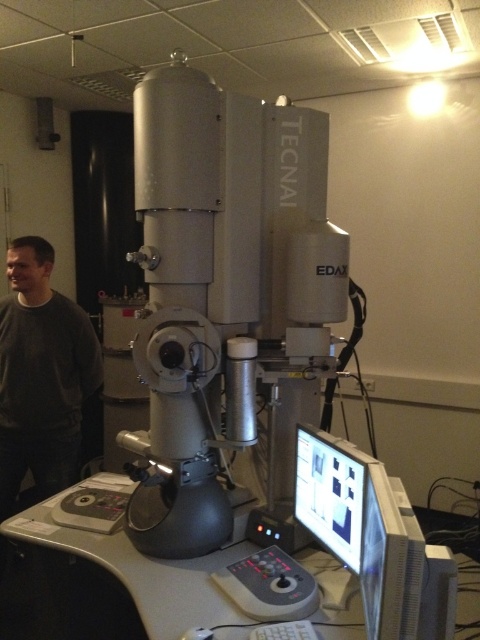
Question: Which object is positioned closest to the white plastic monitor at lower right?

Choices:
 (A) gray plastic table at lower center
 (B) dark gray sweater at left

Answer: (A)

Question: Does white plastic monitor at lower right appear under dark gray sweater at left?

Choices:
 (A) yes
 (B) no

Answer: (A)

Question: Which object is positioned closest to the gray plastic table at lower center?

Choices:
 (A) white plastic monitor at lower right
 (B) dark gray sweater at left

Answer: (A)

Question: Among these points, which one is nearest to the camera?

Choices:
 (A) (316, 458)
 (B) (192, 589)
 (C) (14, 241)

Answer: (B)

Question: Can you confirm if white plastic monitor at lower right is positioned below dark gray sweater at left?

Choices:
 (A) yes
 (B) no

Answer: (A)

Question: Is gray plastic table at lower center to the left of dark gray sweater at left from the viewer's perspective?

Choices:
 (A) yes
 (B) no

Answer: (B)